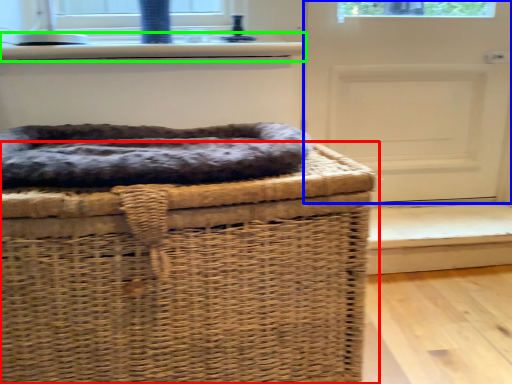
Question: Based on their relative distances, which object is nearer to furniture (highlighted by a red box)? Choose from door (highlighted by a blue box) and window sill (highlighted by a green box).

Choices:
 (A) door
 (B) window sill

Answer: (B)